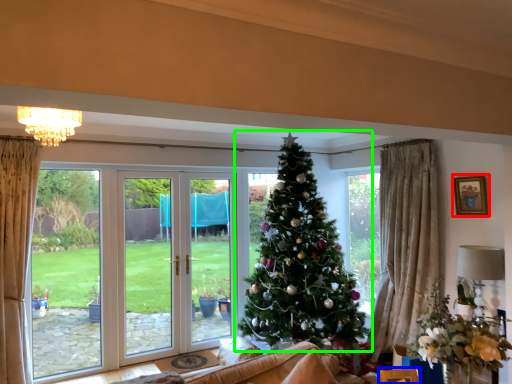
Question: Considering the real-world distances, which object is farthest from picture frame (highlighted by a red box)? furniture (highlighted by a blue box) or christmas tree (highlighted by a green box)?

Choices:
 (A) furniture
 (B) christmas tree

Answer: (A)